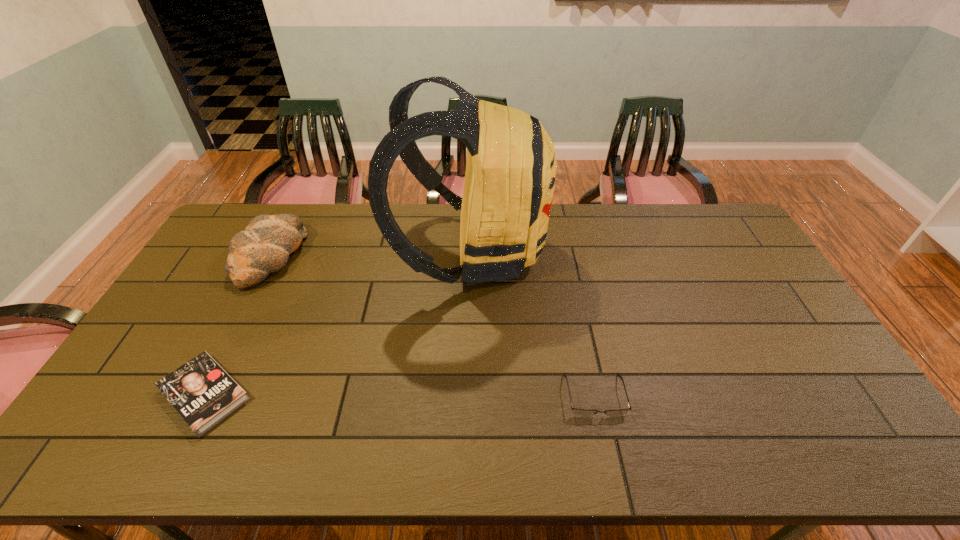
The width and height of the screenshot is (960, 540). Find the location of `empty space between the third shortest object and the spectacles`. empty space between the third shortest object and the spectacles is located at coordinates click(x=432, y=326).

Where is `unoccupied area between the spectacles and the backpack`? unoccupied area between the spectacles and the backpack is located at coordinates (533, 323).

Locate an element on the screen. The image size is (960, 540). empty space that is in between the spectacles and the backpack is located at coordinates coord(533,323).

At what (x,y) coordinates should I click in order to perform the action: click on vacant area that lies between the book and the third shortest object. Please return your answer as a coordinate pair (x, y). This screenshot has width=960, height=540. Looking at the image, I should click on (237, 326).

The width and height of the screenshot is (960, 540). In order to click on free spot between the bread and the spectacles in this screenshot , I will do `click(432, 326)`.

At what (x,y) coordinates should I click in order to perform the action: click on free spot between the shortest object and the backpack. Please return your answer as a coordinate pair (x, y). The height and width of the screenshot is (540, 960). Looking at the image, I should click on (338, 323).

At what (x,y) coordinates should I click in order to perform the action: click on free space between the spectacles and the shortest object. Please return your answer as a coordinate pair (x, y). The image size is (960, 540). Looking at the image, I should click on (399, 395).

The width and height of the screenshot is (960, 540). I want to click on free spot between the third tallest object and the bread, so click(x=432, y=326).

In order to click on free space that is in between the shortest object and the backpack in this screenshot , I will do `click(338, 323)`.

Find the location of a particular element. unoccupied area between the spectacles and the shortest object is located at coordinates point(399,395).